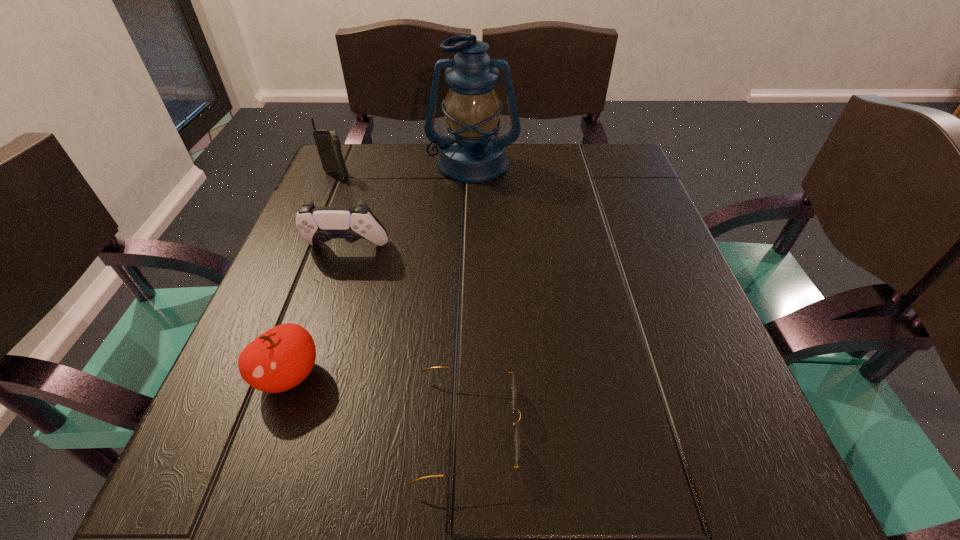
Identify the location of the tallest object. The width and height of the screenshot is (960, 540). (473, 154).

This screenshot has height=540, width=960. In order to click on cellular telephone in this screenshot , I will do `click(328, 144)`.

Where is `control`? control is located at coordinates (315, 224).

The height and width of the screenshot is (540, 960). What are the coordinates of `apple` in the screenshot? It's located at (281, 358).

What are the coordinates of `spectacles` in the screenshot? It's located at (516, 435).

Where is `vacant space located on the face of the tallest object`? vacant space located on the face of the tallest object is located at coordinates (470, 306).

You are a GUI agent. You are given a task and a screenshot of the screen. Output one action in this format:
    pyautogui.click(x=<x>, y=<y>)
    Task: Click on the free region located on the keyboard of the cellular telephone
    The width and height of the screenshot is (960, 540).
    Given the screenshot: What is the action you would take?
    pyautogui.click(x=317, y=222)

Find the location of a particular element. vacant point located 0.140m on the front-facing side of the third nearest object is located at coordinates (324, 318).

Find the location of `vacant region located 0.090m on the front of the apple`. vacant region located 0.090m on the front of the apple is located at coordinates (255, 470).

Find the location of `vacant area situated 0.110m on the temples of the shortest object`. vacant area situated 0.110m on the temples of the shortest object is located at coordinates coord(599,428).